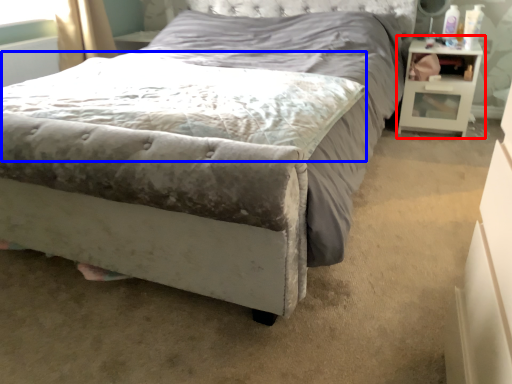
Question: Which object appears farthest to the camera in this image, nightstand (highlighted by a red box) or mattress (highlighted by a blue box)?

Choices:
 (A) nightstand
 (B) mattress

Answer: (A)